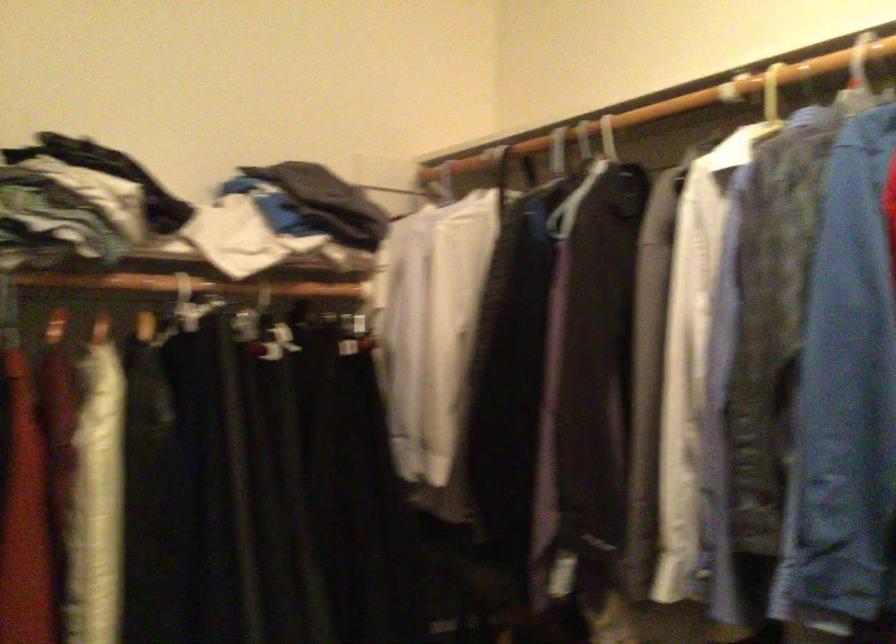
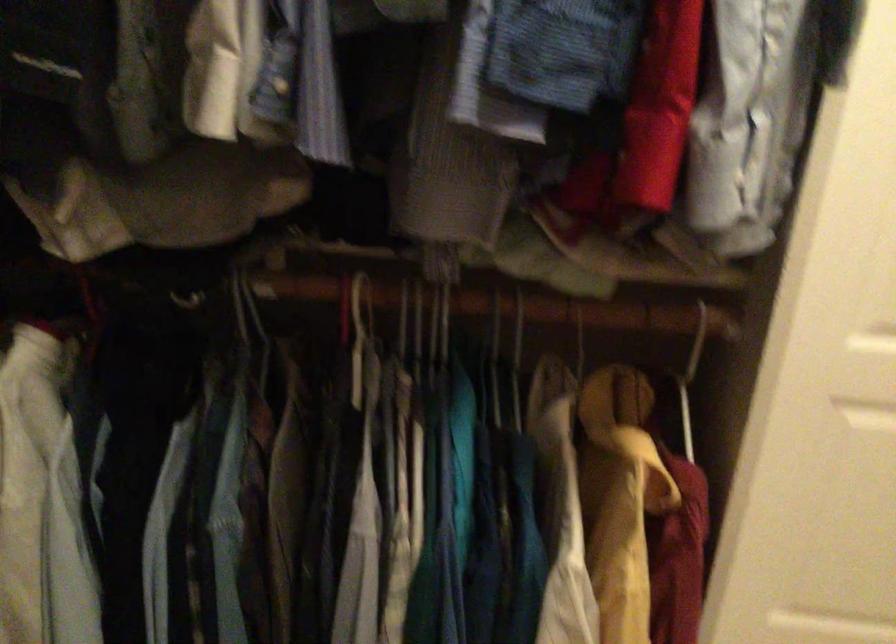
The first image is from the beginning of the video and the second image is from the end. How did the camera likely rotate when shooting the video?

The camera rotated toward right-down.